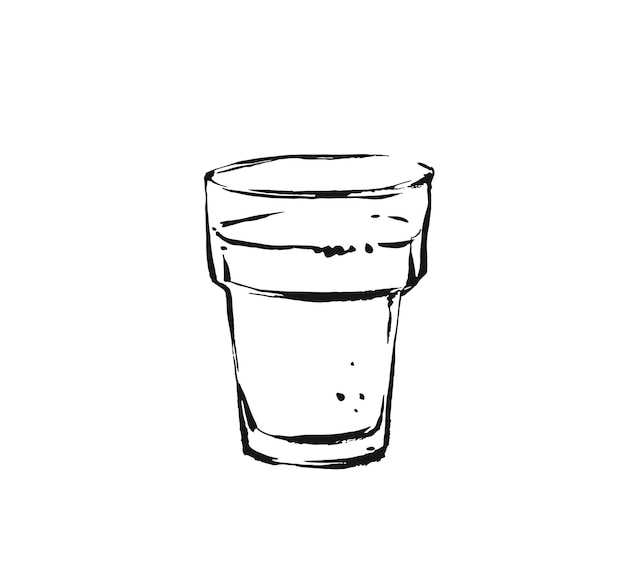
At what (x,y) coordinates should I click in order to perform the action: click on bottom of the cup. Please return your answer as a coordinate pair (x, y). The width and height of the screenshot is (626, 579). Looking at the image, I should click on (321, 457).